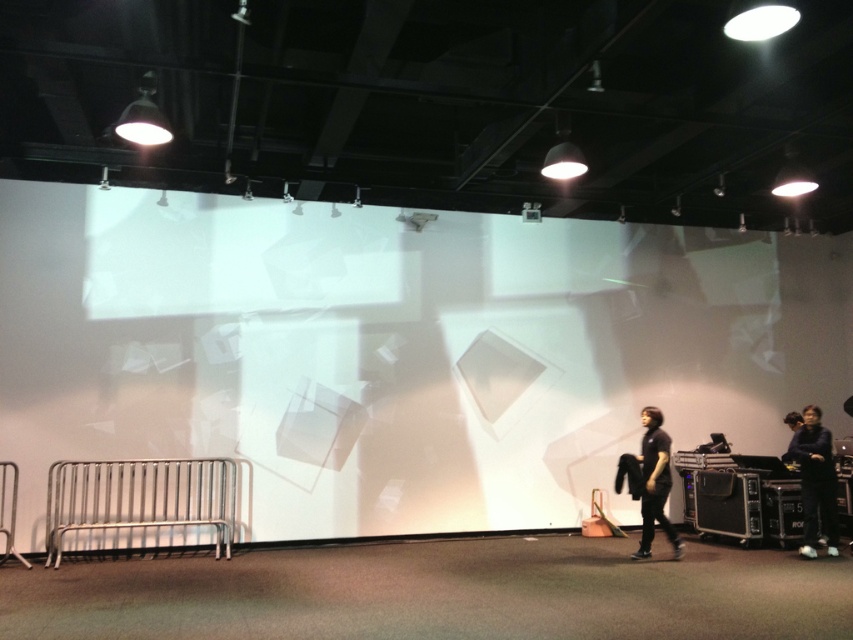
You are a stagehand who needs to move a 5 feet long ladder from the storage area to the stage. You see the dark blue fabric jacket at lower right and the dark gray shirt at lower right. Will the ladder fit between them without bending?

The distance between the dark blue fabric jacket at lower right and the dark gray shirt at lower right is 4.91 feet. Since the ladder is 5 feet long, it will not fit between them without bending.

You are an event organizer checking the stage setup. You notice two items at the lower right corner of the stage. Which one is narrower between the dark blue fabric jacket at lower right and the dark gray shirt at lower right?

The dark blue fabric jacket at lower right is thinner than the dark gray shirt at lower right, so the dark blue fabric jacket at lower right is narrower.

You are standing at the center of the stage and want to move to the point marked as point (x=808, y=440). However, there is an obstacle at point (x=660, y=506). Can you reach your destination without going around the obstacle?

Point (x=808, y=440) is behind point (x=660, y=506), so you cannot reach it without going around the obstacle.